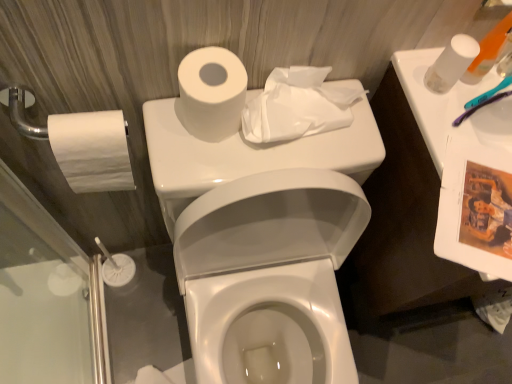
Image resolution: width=512 pixels, height=384 pixels. I want to click on free point in front of white matte tissue at upper center, the third toilet paper in the left-to-right sequence, so click(272, 167).